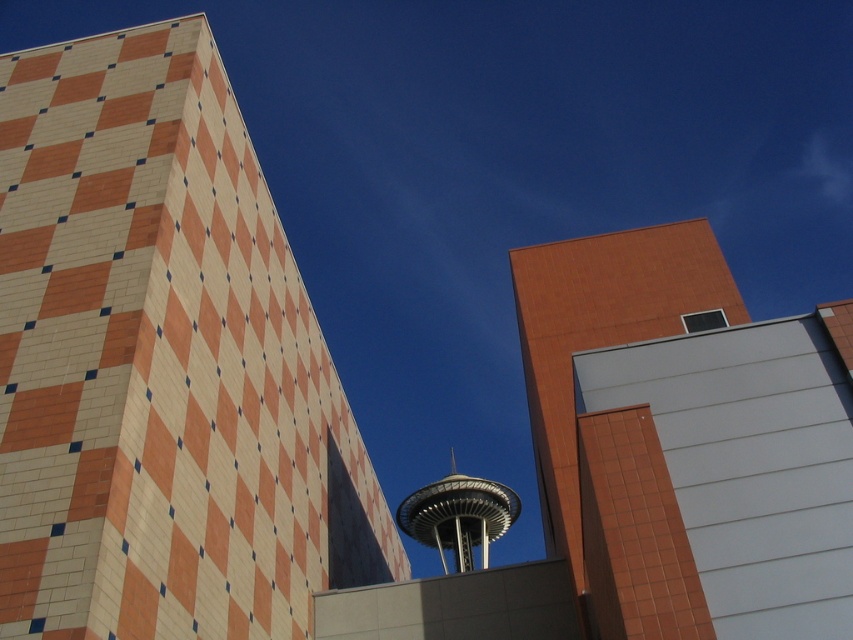
Between orange-tiled tower at left and metallic silver tower at center, which one is positioned lower?

metallic silver tower at center

Is orange-tiled tower at left above metallic silver tower at center?

Yes.

You are a GUI agent. You are given a task and a screenshot of the screen. Output one action in this format:
    pyautogui.click(x=<x>, y=<y>)
    Task: Click on the orange-tiled tower at left
    
    Given the screenshot: What is the action you would take?
    pyautogui.click(x=161, y=364)